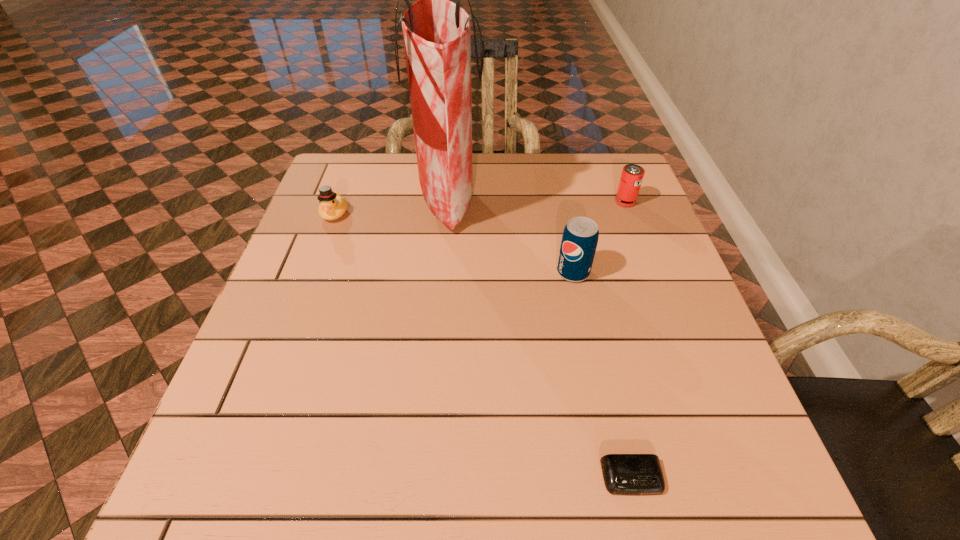
Find the location of a particular element. object located in the far left corner section of the desktop is located at coordinates (332, 206).

Where is `object at the far right corner`? The height and width of the screenshot is (540, 960). object at the far right corner is located at coordinates (632, 175).

Where is `object located in the near right corner section of the desktop`? This screenshot has width=960, height=540. object located in the near right corner section of the desktop is located at coordinates (624, 474).

At what (x,y) coordinates should I click in order to perform the action: click on free space at the far edge of the desktop. Please return your answer as a coordinate pair (x, y). The width and height of the screenshot is (960, 540). Looking at the image, I should click on (549, 161).

Identify the location of vacant point at the left edge. This screenshot has height=540, width=960. (296, 379).

This screenshot has height=540, width=960. What are the coordinates of `vacant space at the right edge of the desktop` in the screenshot? It's located at (679, 283).

Locate an element on the screen. The image size is (960, 540). free space at the far left corner is located at coordinates (341, 183).

Where is `vacant space at the near left corner of the desktop`? Image resolution: width=960 pixels, height=540 pixels. vacant space at the near left corner of the desktop is located at coordinates (179, 501).

The width and height of the screenshot is (960, 540). Identify the location of free space at the far right corner. (594, 168).

The image size is (960, 540). I want to click on blank space at the near right corner of the desktop, so click(676, 464).